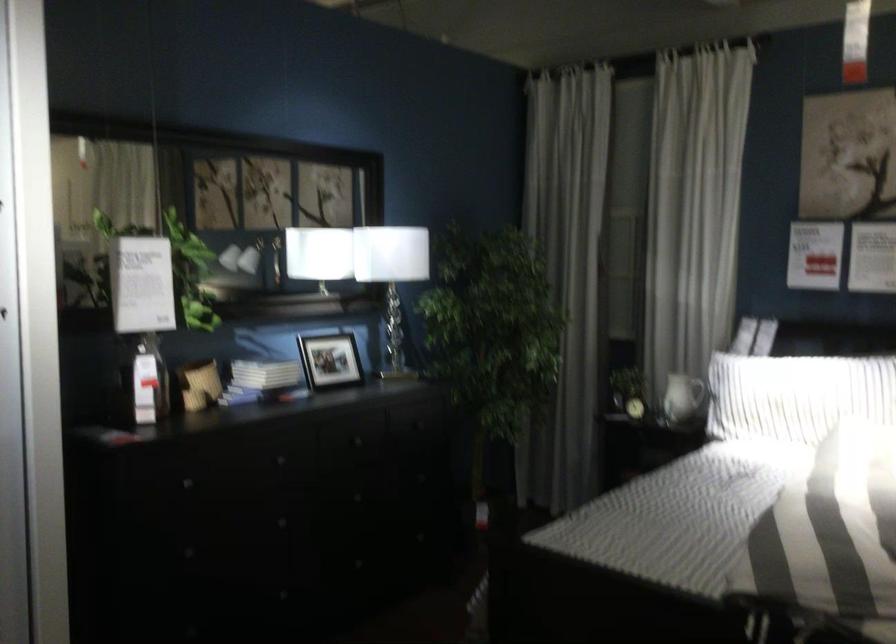
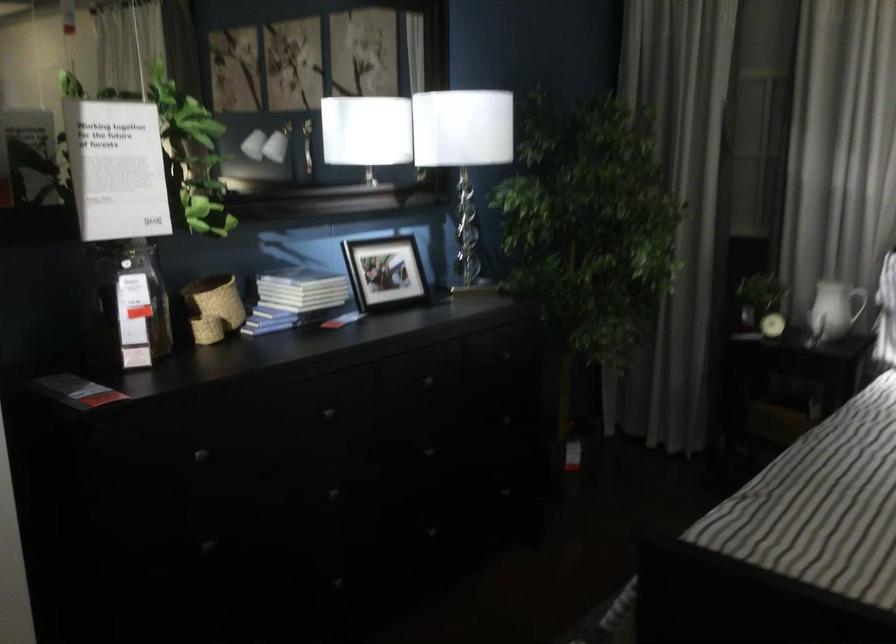
Question: The first image is from the beginning of the video and the second image is from the end. How did the camera likely rotate when shooting the video?

Choices:
 (A) Left
 (B) Right
 (C) Up
 (D) Down

Answer: (D)